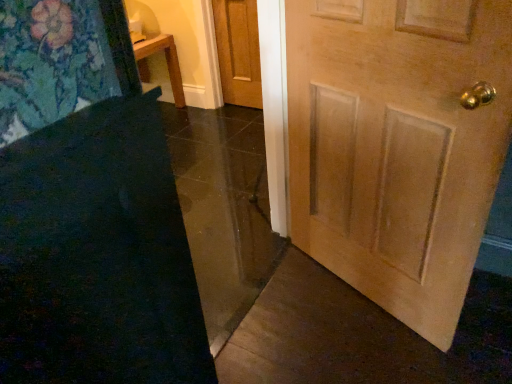
Question: In the image, is light brown wood door at center, which ranks as the 1th door in bottom-to-top order, on the left side or the right side of dark blue carpet at lower left?

Choices:
 (A) right
 (B) left

Answer: (A)

Question: Considering the positions of light brown wood door at center, marked as the first door in a right-to-left arrangement, and dark blue carpet at lower left in the image, is light brown wood door at center, marked as the first door in a right-to-left arrangement, taller or shorter than dark blue carpet at lower left?

Choices:
 (A) short
 (B) tall

Answer: (B)

Question: Estimate the real-world distances between objects in this image. Which object is closer to the light brown wood door at center, marked as the first door in a right-to-left arrangement?

Choices:
 (A) dark blue carpet at lower left
 (B) light brown wood door at center, the 1th door from the top

Answer: (A)

Question: Estimate the real-world distances between objects in this image. Which object is closer to the dark blue carpet at lower left?

Choices:
 (A) light brown wood door at center, the 2th door viewed from the back
 (B) light brown wood door at center, the 1th door from the top

Answer: (A)